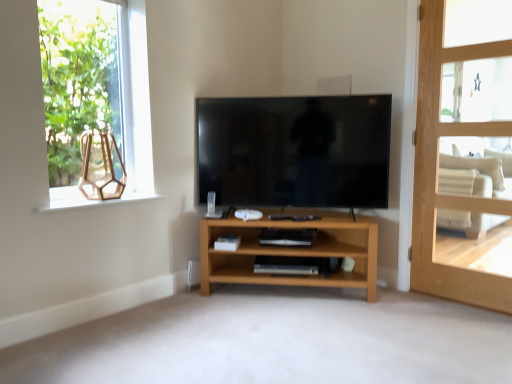
Question: Considering the positions of point (358, 110) and point (467, 195), is point (358, 110) closer or farther from the camera than point (467, 195)?

Choices:
 (A) closer
 (B) farther

Answer: (A)

Question: Is black glossy tv at center wider or thinner than beige fabric armchair at right?

Choices:
 (A) wide
 (B) thin

Answer: (B)

Question: Estimate the real-world distances between objects in this image. Which object is farther from the clear glass window at upper left?

Choices:
 (A) matte glass window sill at upper left
 (B) beige fabric armchair at right
 (C) light brown wooden door at right
 (D) black glossy tv at center
 (E) light wood shelf at center

Answer: (B)

Question: Estimate the real-world distances between objects in this image. Which object is farther from the light wood shelf at center?

Choices:
 (A) light brown wooden door at right
 (B) clear glass window at upper left
 (C) black glossy tv at center
 (D) beige fabric armchair at right
 (E) matte glass window sill at upper left

Answer: (B)